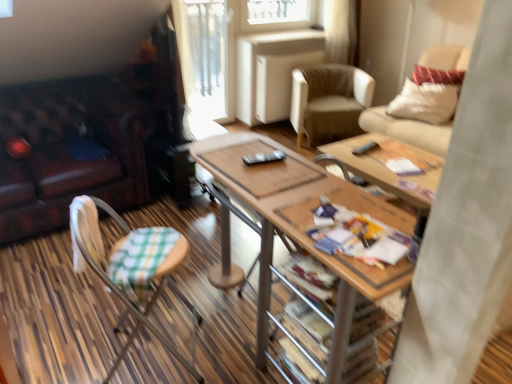
Question: From a real-world perspective, does beige fabric chair at upper right, placed as the second chair when sorted from bottom to top, sit lower than green checkered fabric chair at lower left, which is the 3th chair in right-to-left order?

Choices:
 (A) no
 (B) yes

Answer: (A)

Question: From the image's perspective, is beige fabric chair at upper right, the 2th chair in the top-to-bottom sequence, under green checkered fabric chair at lower left, the 1th chair in the front-to-back sequence?

Choices:
 (A) no
 (B) yes

Answer: (A)

Question: Considering the relative sizes of beige fabric chair at upper right, which appears as the first chair when viewed from the right, and green checkered fabric chair at lower left, the 1th chair in the front-to-back sequence, in the image provided, is beige fabric chair at upper right, which appears as the first chair when viewed from the right, smaller than green checkered fabric chair at lower left, the 1th chair in the front-to-back sequence,?

Choices:
 (A) yes
 (B) no

Answer: (A)

Question: Considering the relative sizes of beige fabric chair at upper right, which is the third chair in left-to-right order, and green checkered fabric chair at lower left, which is the 3th chair in right-to-left order, in the image provided, is beige fabric chair at upper right, which is the third chair in left-to-right order, bigger than green checkered fabric chair at lower left, which is the 3th chair in right-to-left order,?

Choices:
 (A) no
 (B) yes

Answer: (A)

Question: From the image's perspective, is beige fabric chair at upper right, the 2th chair in the top-to-bottom sequence, on green checkered fabric chair at lower left, the 1th chair positioned from the bottom?

Choices:
 (A) no
 (B) yes

Answer: (B)

Question: Is beige fabric chair at upper right, the 2th chair in the top-to-bottom sequence, facing towards green checkered fabric chair at lower left, which is the 3th chair in right-to-left order?

Choices:
 (A) yes
 (B) no

Answer: (A)

Question: From the image's perspective, is printed paper magazine at center located beneath woodenmaterial/texturetable at center?

Choices:
 (A) no
 (B) yes

Answer: (A)

Question: Can you confirm if printed paper magazine at center is wider than woodenmaterial/texturetable at center?

Choices:
 (A) no
 (B) yes

Answer: (A)

Question: Can you confirm if printed paper magazine at center is positioned to the left of woodenmaterial/texturetable at center?

Choices:
 (A) yes
 (B) no

Answer: (B)

Question: Is printed paper magazine at center further to camera compared to woodenmaterial/texturetable at center?

Choices:
 (A) no
 (B) yes

Answer: (B)

Question: Would you say printed paper magazine at center is outside woodenmaterial/texturetable at center?

Choices:
 (A) no
 (B) yes

Answer: (B)

Question: Can you confirm if printed paper magazine at center is shorter than woodenmaterial/texturetable at center?

Choices:
 (A) yes
 (B) no

Answer: (A)

Question: Is beige leather armchair at center, which is counted as the second chair, starting from the left, outside green checkered fabric chair at lower left, the third chair from the top?

Choices:
 (A) no
 (B) yes

Answer: (B)